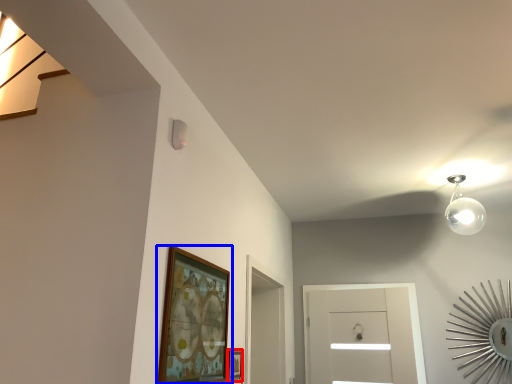
Question: Which object appears farthest to the camera in this image, picture frame (highlighted by a red box) or picture frame (highlighted by a blue box)?

Choices:
 (A) picture frame
 (B) picture frame

Answer: (A)